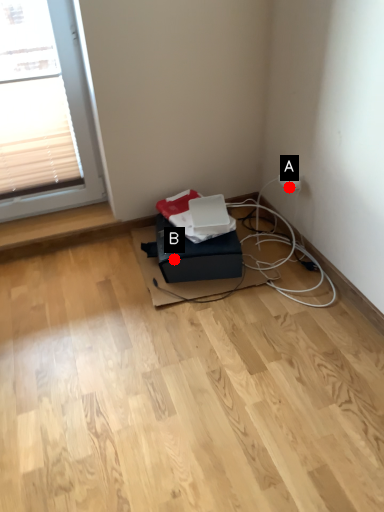
Question: Two points are circled on the image, labeled by A and B beside each circle. Which point is closer to the camera?

Choices:
 (A) A is closer
 (B) B is closer

Answer: (B)